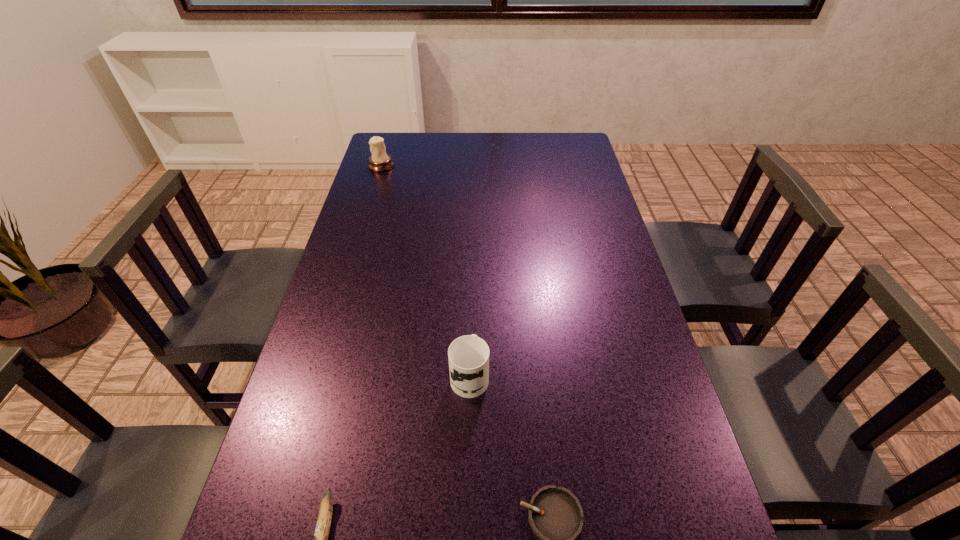
At what (x,y) coordinates should I click in order to perform the action: click on the leftmost object. Please return your answer as a coordinate pair (x, y). Image resolution: width=960 pixels, height=540 pixels. Looking at the image, I should click on (380, 161).

You are a GUI agent. You are given a task and a screenshot of the screen. Output one action in this format:
    pyautogui.click(x=<x>, y=<y>)
    Task: Click on the candle holder
    This screenshot has height=540, width=960.
    Given the screenshot: What is the action you would take?
    pyautogui.click(x=380, y=161)

Where is `mug`? mug is located at coordinates (468, 355).

Locate an element on the screen. The image size is (960, 540). the third nearest object is located at coordinates click(468, 355).

You are a GUI agent. You are given a task and a screenshot of the screen. Output one action in this format:
    pyautogui.click(x=<x>, y=<y>)
    Task: Click on the free space located 0.260m on the right of the candle holder
    
    Given the screenshot: What is the action you would take?
    pyautogui.click(x=462, y=166)

Where is `free space located on the handle side of the third object from left to right`? The width and height of the screenshot is (960, 540). free space located on the handle side of the third object from left to right is located at coordinates (472, 248).

The width and height of the screenshot is (960, 540). What are the coordinates of `free location located on the handle side of the third object from left to right` in the screenshot? It's located at (472, 260).

Find the location of a particular element. The width and height of the screenshot is (960, 540). vacant space located on the handle side of the third object from left to right is located at coordinates (471, 289).

Locate an element on the screen. This screenshot has height=540, width=960. object located in the far edge section of the desktop is located at coordinates (380, 161).

Identify the location of object that is at the left edge. Image resolution: width=960 pixels, height=540 pixels. (380, 161).